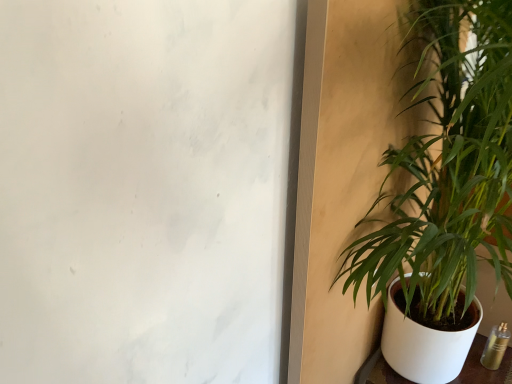
Question: Is green leafy plant at right inside or outside of white ceramic flowerpot at right?

Choices:
 (A) outside
 (B) inside

Answer: (A)

Question: From the image's perspective, is green leafy plant at right positioned above or below white ceramic flowerpot at right?

Choices:
 (A) above
 (B) below

Answer: (A)

Question: Is green leafy plant at right in front of or behind white ceramic flowerpot at right in the image?

Choices:
 (A) front
 (B) behind

Answer: (A)

Question: Is white ceramic flowerpot at right taller or shorter than green leafy plant at right?

Choices:
 (A) tall
 (B) short

Answer: (B)

Question: Visually, is white ceramic flowerpot at right positioned to the left or to the right of green leafy plant at right?

Choices:
 (A) right
 (B) left

Answer: (A)

Question: Considering the positions of white ceramic flowerpot at right and green leafy plant at right in the image, is white ceramic flowerpot at right bigger or smaller than green leafy plant at right?

Choices:
 (A) small
 (B) big

Answer: (A)

Question: In terms of width, does white ceramic flowerpot at right look wider or thinner when compared to green leafy plant at right?

Choices:
 (A) thin
 (B) wide

Answer: (B)